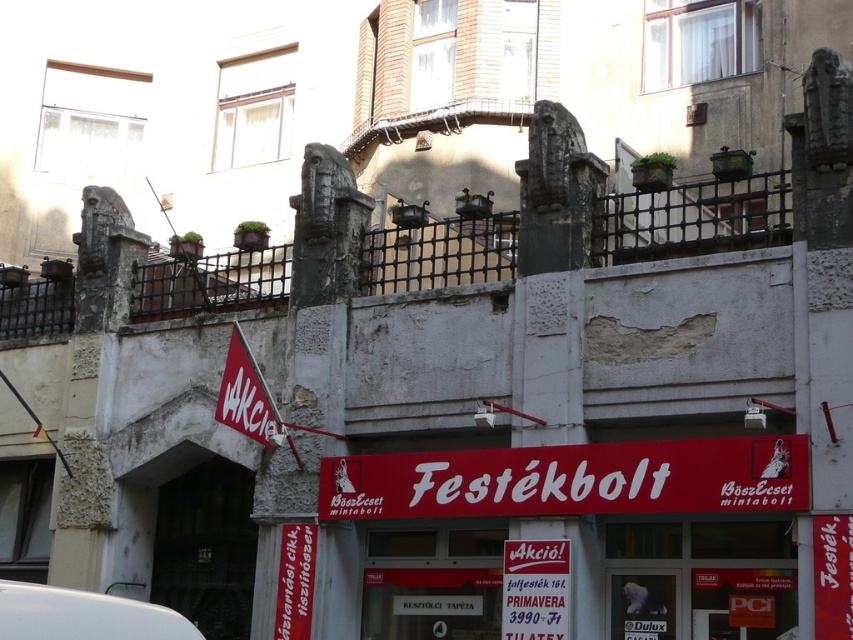
You are a delivery person who needs to place a new package between the red matte sign at center and the red fabric sign at lower left. The package is 3 meters long. Will there be enough space between them to place the package horizontally?

The distance between the red matte sign at center and the red fabric sign at lower left is 5.77 meters. Since the package is 3 meters long, there is sufficient space to place it horizontally between them.